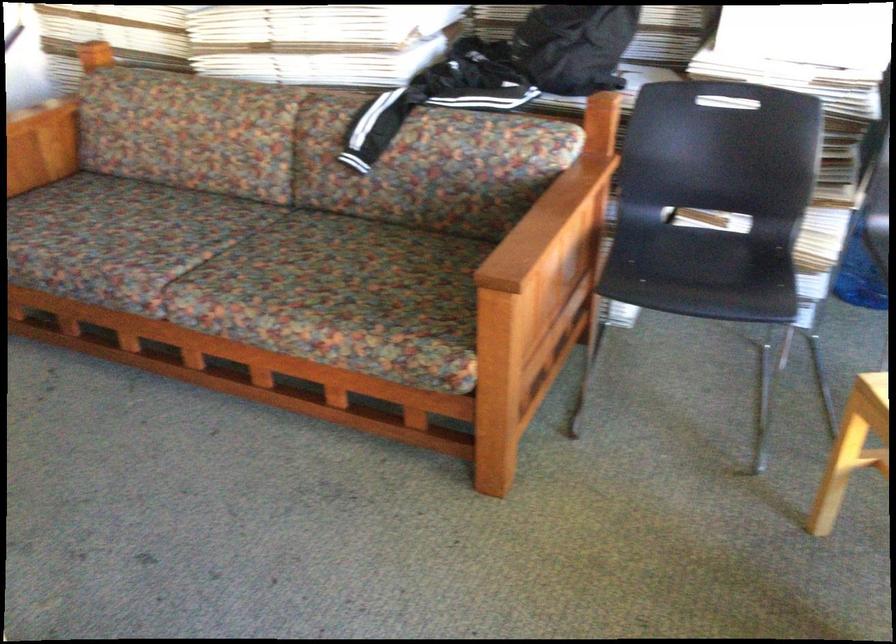
Image resolution: width=896 pixels, height=644 pixels. Describe the element at coordinates (256, 275) in the screenshot. I see `the sofa sitting surface` at that location.